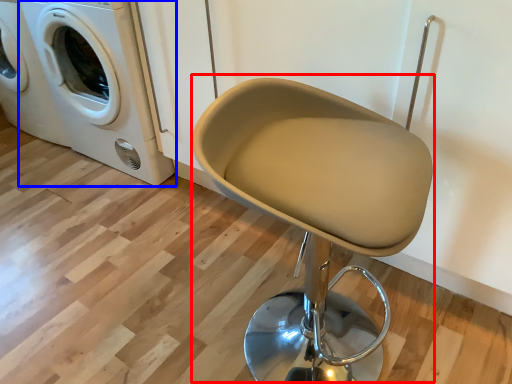
Question: Which object is further to the camera taking this photo, swivel chair (highlighted by a red box) or washing machine (highlighted by a blue box)?

Choices:
 (A) swivel chair
 (B) washing machine

Answer: (B)